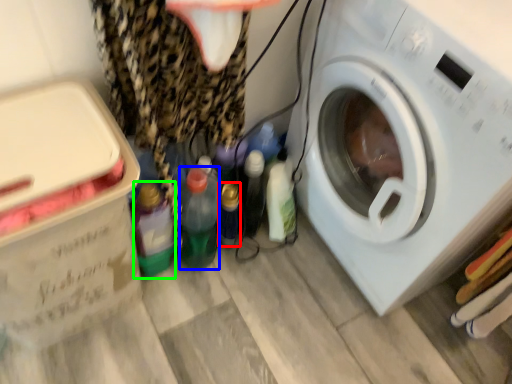
Question: Estimate the real-world distances between objects in this image. Which object is farther from bottle (highlighted by a red box), bottle (highlighted by a blue box) or bottle (highlighted by a green box)?

Choices:
 (A) bottle
 (B) bottle

Answer: (B)